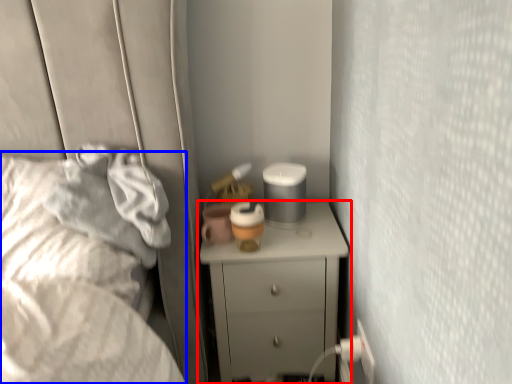
Question: Which of the following is the closest to the observer, chest of drawers (highlighted by a red box) or bed (highlighted by a blue box)?

Choices:
 (A) chest of drawers
 (B) bed

Answer: (B)